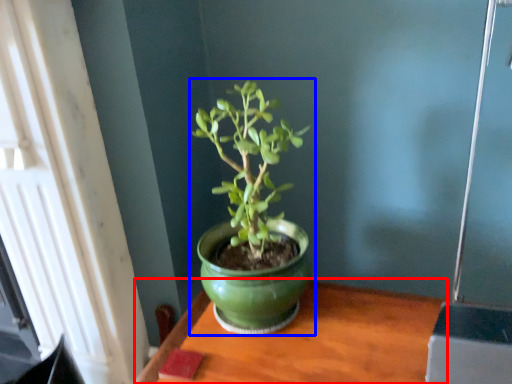
Question: Which object is further to the camera taking this photo, table (highlighted by a red box) or houseplant (highlighted by a blue box)?

Choices:
 (A) table
 (B) houseplant

Answer: (B)